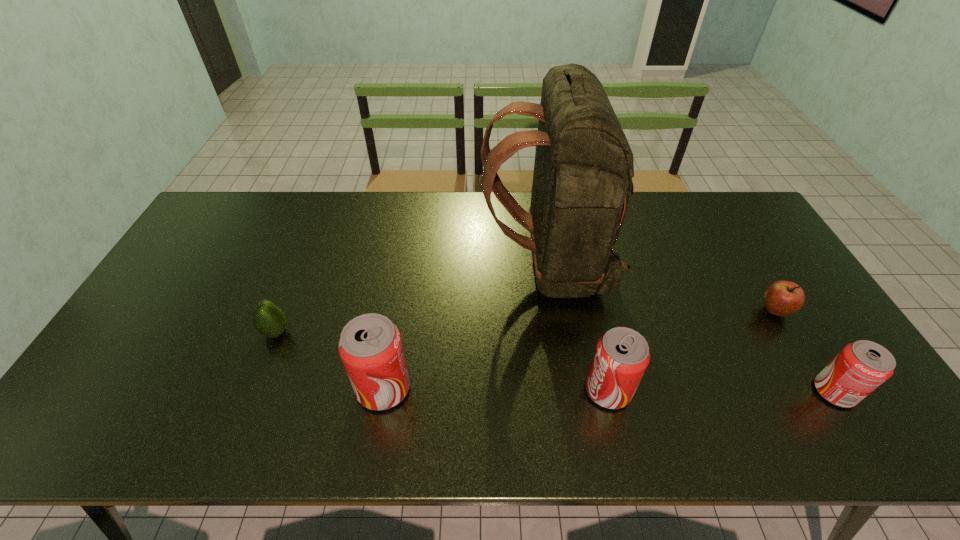
Identify the location of empty location between the third shortest object and the second tallest soda can. (721, 390).

Where is `free spot between the second tallest soda can and the shortest soda can`? This screenshot has height=540, width=960. free spot between the second tallest soda can and the shortest soda can is located at coordinates (721, 390).

The width and height of the screenshot is (960, 540). Find the location of `free area in between the fifth object from right to left and the apple`. free area in between the fifth object from right to left and the apple is located at coordinates (579, 349).

This screenshot has height=540, width=960. What are the coordinates of `free space between the leftmost soda can and the apple` in the screenshot? It's located at (579, 349).

Identify the location of empty location between the backpack and the rightmost soda can. (691, 329).

Locate an element on the screen. This screenshot has width=960, height=540. object that ranks as the third closest to the tallest object is located at coordinates (782, 298).

The height and width of the screenshot is (540, 960). Find the location of `object that is the second closest to the tallest object`. object that is the second closest to the tallest object is located at coordinates (370, 346).

Locate an element on the screen. The width and height of the screenshot is (960, 540). the closest soda can to the backpack is located at coordinates (622, 355).

The width and height of the screenshot is (960, 540). Identify the location of soda can object that ranks as the second closest to the avocado. (622, 355).

Image resolution: width=960 pixels, height=540 pixels. Identify the location of vacant space that satisfies the following two spatial constraints: 1. on the front side of the second shortest soda can; 2. on the left side of the leftmost soda can. (383, 390).